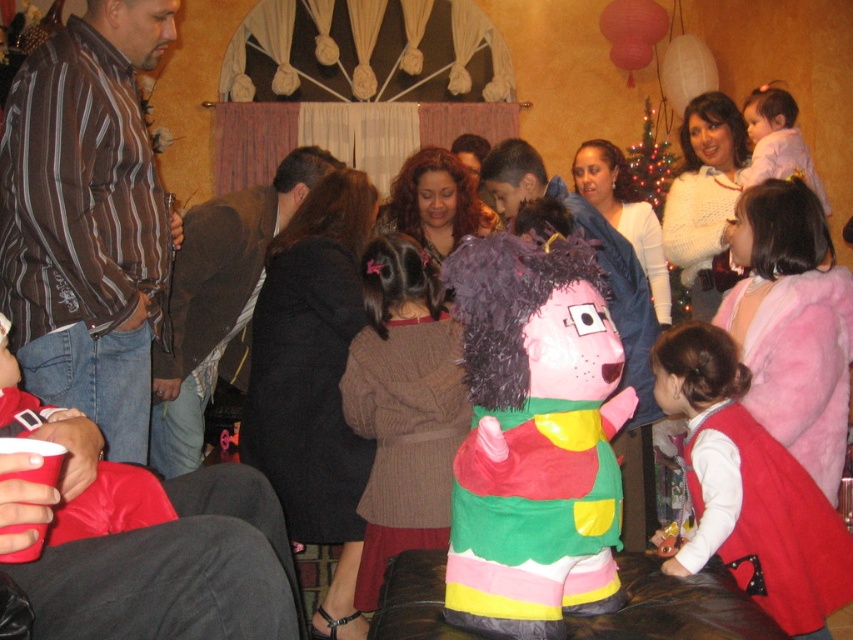
Between plush pink pinata at center and matte pink dress at lower right, which one has less height?

plush pink pinata at center is shorter.

Can you confirm if plush pink pinata at center is bigger than matte pink dress at lower right?

No, plush pink pinata at center is not bigger than matte pink dress at lower right.

Describe the element at coordinates (534, 438) in the screenshot. I see `plush pink pinata at center` at that location.

Locate an element on the screen. The width and height of the screenshot is (853, 640). plush pink pinata at center is located at coordinates (534, 438).

Who is higher up, plush pink pinata at center or dark brown coat at center?

dark brown coat at center is higher up.

Does plush pink pinata at center have a greater width compared to dark brown coat at center?

Incorrect, plush pink pinata at center's width does not surpass dark brown coat at center's.

Locate an element on the screen. plush pink pinata at center is located at coordinates (534, 438).

Looking at this image, measure the distance between point (106, 337) and camera.

Point (106, 337) is 3.59 meters from camera.

How far apart are brown striped shirt at left and dark brown coat at center?

The distance of brown striped shirt at left from dark brown coat at center is 3.43 feet.

Identify the location of brown striped shirt at left. (86, 218).